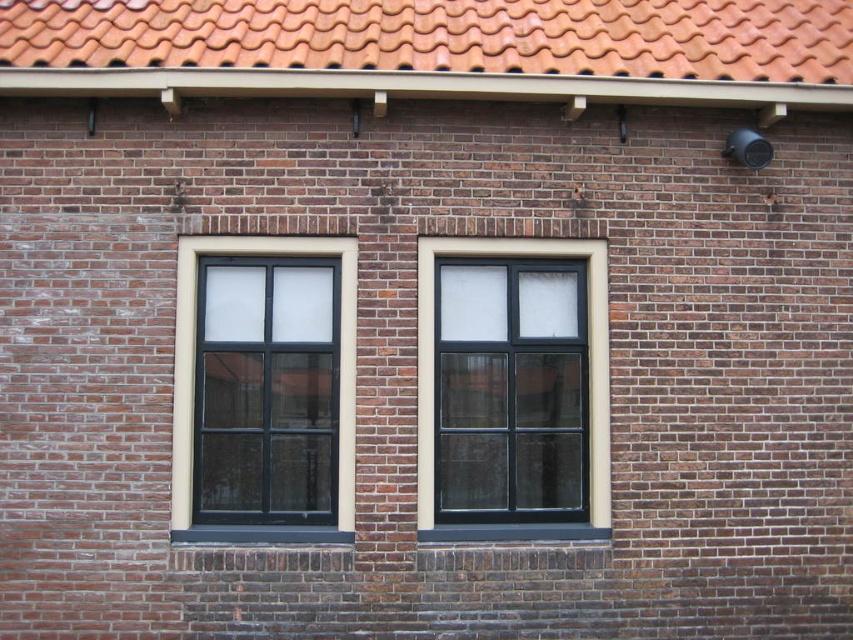
You are standing in front of a brick building with two windows. You notice a black glass window at center and a black matte window at left. Which window is closer to you?

The black glass window at center is closer to you because it is further to the viewer than the black matte window at left.

You are standing in front of a brick building with two windows. You notice a point at coordinates (x=587, y=344). Which object is located at this point?

The black glass window at center is located at point (x=587, y=344).

You are a window washer standing on a ladder. You need to clean the black matte window at left but must avoid getting too close to the terracotta clay tiles at top. Can you safely clean the window without reaching the tiles?

The distance between the terracotta clay tiles at top and the black matte window at left is 5.67 feet. Since this distance is sufficient, you can safely clean the window without reaching the tiles.